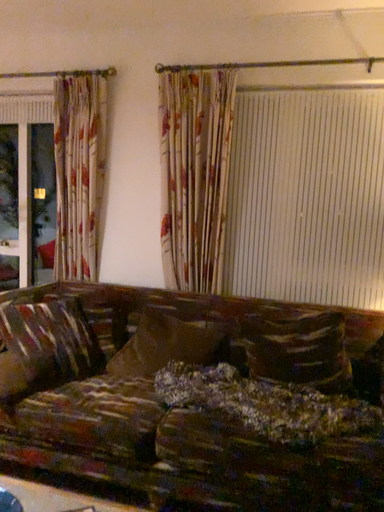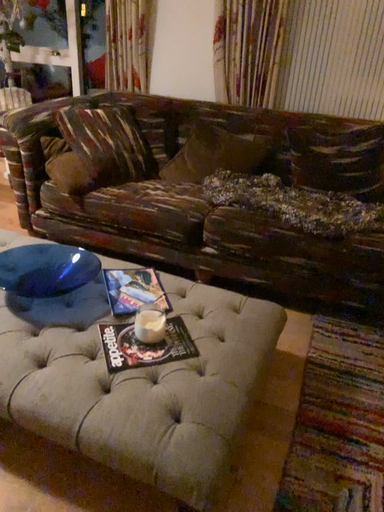
Question: Which way did the camera rotate in the video?

Choices:
 (A) rotated left
 (B) rotated right

Answer: (A)